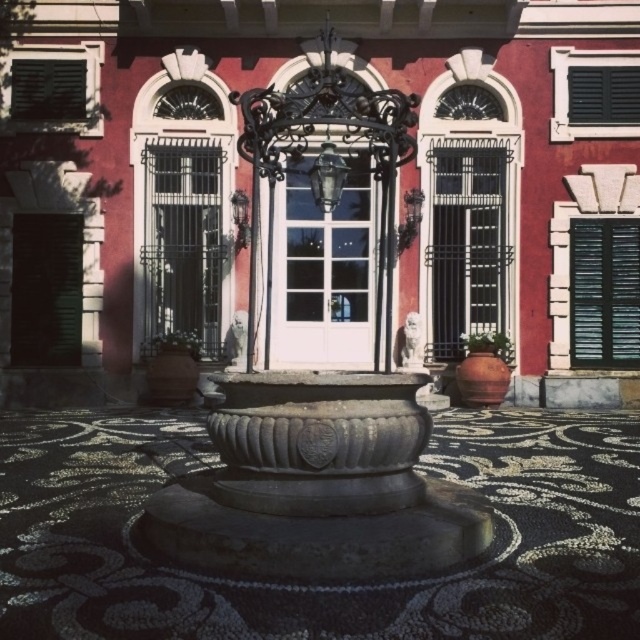
Question: Does black metal gate at center appear on the right side of black wooden shutter at right?

Choices:
 (A) no
 (B) yes

Answer: (A)

Question: Which point is farther from the camera taking this photo?

Choices:
 (A) (628, 236)
 (B) (330, 307)
 (C) (22, 278)
 (D) (609, 122)

Answer: (B)

Question: Which object is positioned farthest from the white glossy door at center?

Choices:
 (A) green matte door at left
 (B) green matte shutter at upper left
 (C) black metal gate at center

Answer: (B)

Question: Estimate the real-world distances between objects in this image. Which object is farther from the black matte shutter at upper right?

Choices:
 (A) white glossy door at center
 (B) black wooden shutter at right

Answer: (A)

Question: Where is white glossy door at center located in relation to green matte shutter at upper left in the image?

Choices:
 (A) above
 (B) below

Answer: (B)

Question: Is black metal gate at center closer to camera compared to green matte door at left?

Choices:
 (A) yes
 (B) no

Answer: (A)